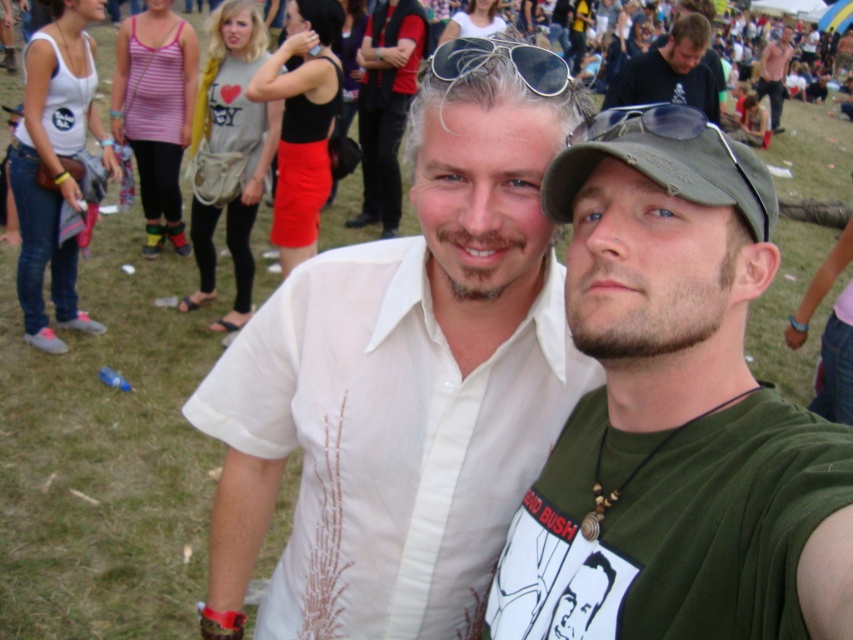
Question: Can you confirm if matte black sunglasses at upper center is positioned below sunglasses at center?

Choices:
 (A) no
 (B) yes

Answer: (A)

Question: Considering the real-world distances, which object is farthest from the white cotton shirt at center?

Choices:
 (A) matte black sunglasses at upper center
 (B) green cotton t-shirt at center

Answer: (A)

Question: Which object appears closest to the camera in this image?

Choices:
 (A) matte black sunglasses at upper center
 (B) green cotton t-shirt at center
 (C) sunglasses at center
 (D) white cotton shirt at center

Answer: (B)

Question: Is white cotton shirt at center below green cotton t-shirt at center?

Choices:
 (A) yes
 (B) no

Answer: (A)

Question: Among these points, which one is nearest to the camera?

Choices:
 (A) (512, 406)
 (B) (509, 54)
 (C) (582, 634)
 (D) (679, 29)

Answer: (C)

Question: Is white cotton shirt at center to the left of green cotton t-shirt at center from the viewer's perspective?

Choices:
 (A) no
 (B) yes

Answer: (B)